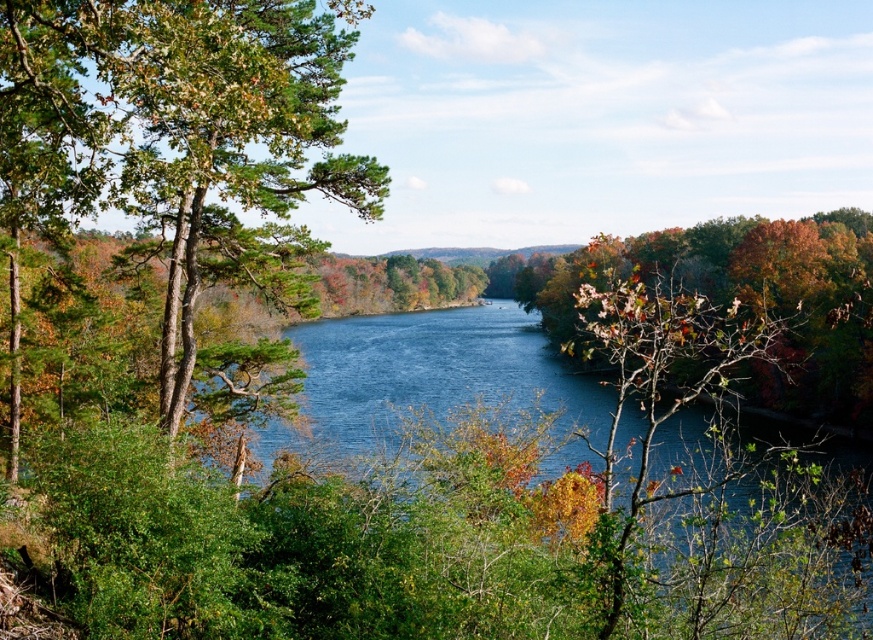
Between point (73, 17) and point (638, 276), which one is positioned behind?

The point (638, 276) is behind.

Can you confirm if green matte tree at left is wider than autumn leaves at right?

In fact, green matte tree at left might be narrower than autumn leaves at right.

Does point (308, 124) come behind point (817, 323)?

That is False.

In order to click on green matte tree at left in this screenshot , I will do `click(174, 140)`.